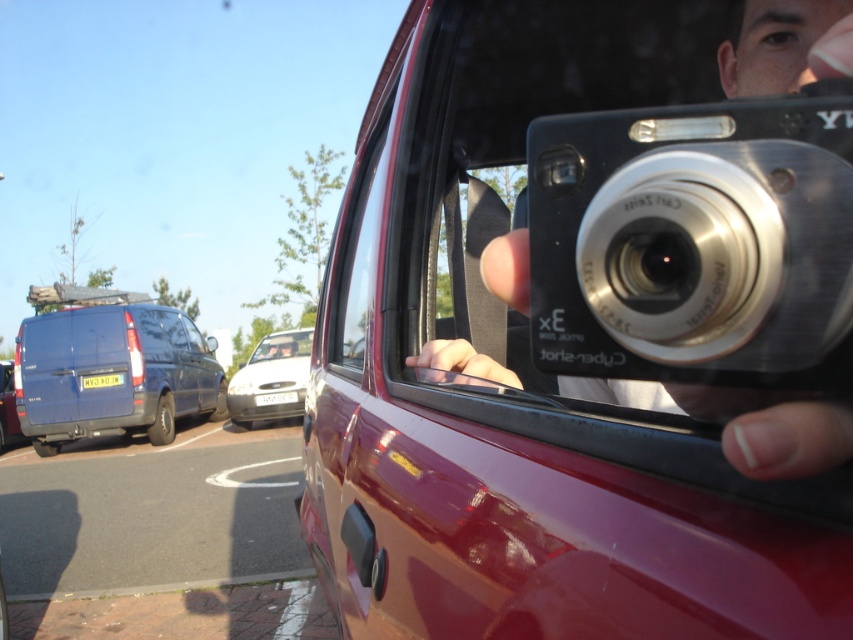
Question: Can you confirm if white glossy car at center is wider than blue metallic van at left?

Choices:
 (A) yes
 (B) no

Answer: (A)

Question: Which object is the closest to the shiny metallic car door at center?

Choices:
 (A) white glossy car at center
 (B) black plastic camera at upper right

Answer: (B)

Question: Which object appears farthest from the camera in this image?

Choices:
 (A) black plastic camera at upper right
 (B) white glossy car at center
 (C) shiny metallic car door at center
 (D) metallic blue van at left

Answer: (B)

Question: Is shiny metallic car door at center in front of black plastic camera at upper right?

Choices:
 (A) no
 (B) yes

Answer: (B)

Question: Which object is closer to the camera taking this photo?

Choices:
 (A) metallic blue van at left
 (B) white glossy car at center

Answer: (A)

Question: Is shiny metallic car door at center bigger than black plastic camera at upper right?

Choices:
 (A) yes
 (B) no

Answer: (A)